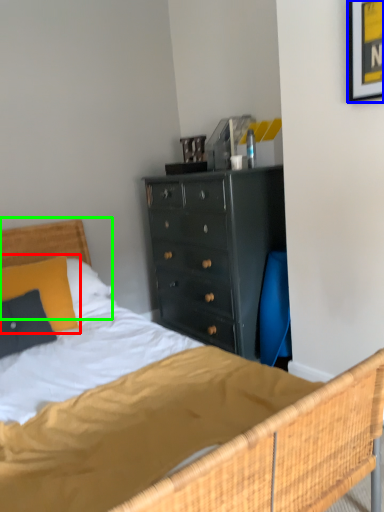
Question: Based on their relative distances, which object is nearer to pillow (highlighted by a red box)? Choose from picture frame (highlighted by a blue box) and headboard (highlighted by a green box).

Choices:
 (A) picture frame
 (B) headboard

Answer: (B)